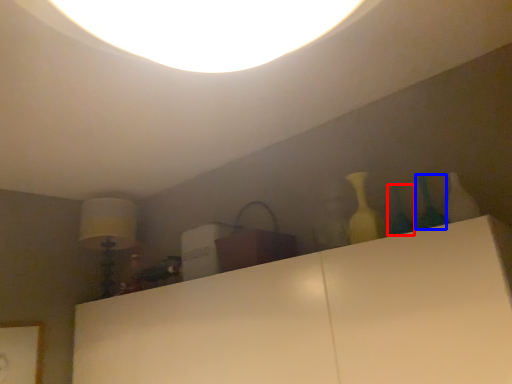
Question: Which object appears farthest to the camera in this image, glass vase (highlighted by a red box) or glass vase (highlighted by a blue box)?

Choices:
 (A) glass vase
 (B) glass vase

Answer: (A)